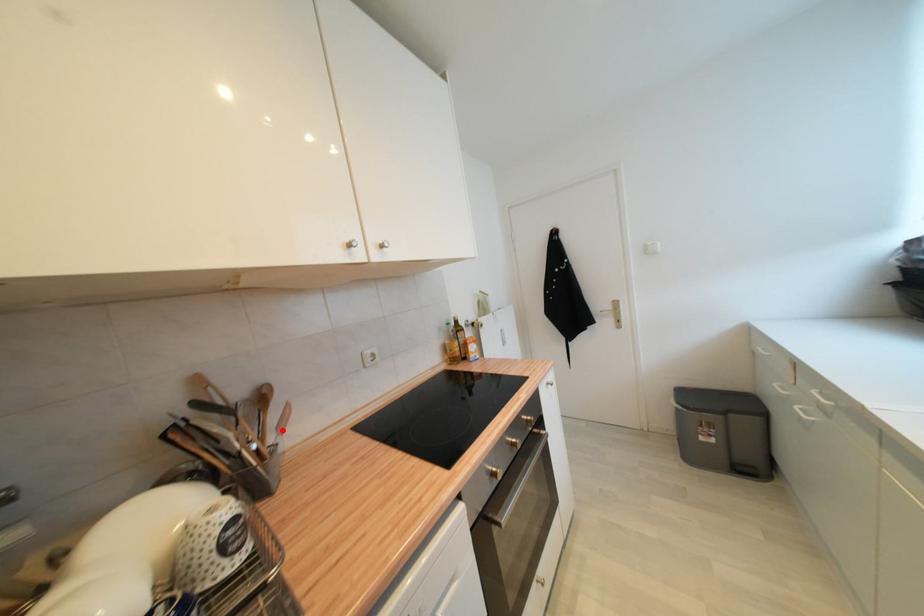
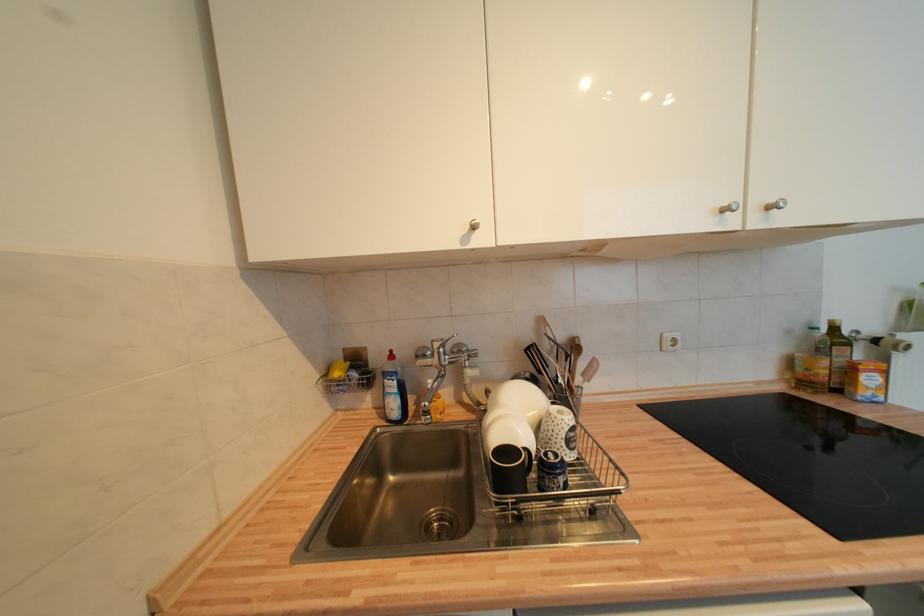
The point at the highlighted location is marked in the first image. Where is the corresponding point in the second image?

(588, 377)